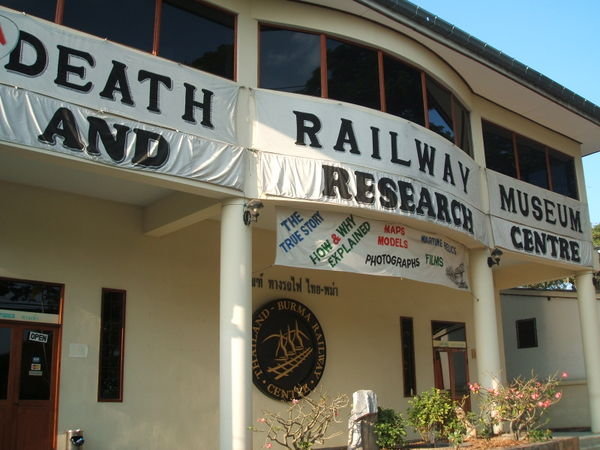
Find the location of `2 windows on 1st floor`. 2 windows on 1st floor is located at coordinates (410, 361), (113, 350).